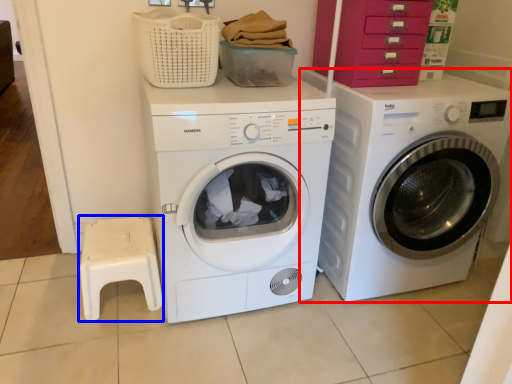
Question: Which object is closer to the camera taking this photo, washing machine (highlighted by a red box) or step stool (highlighted by a blue box)?

Choices:
 (A) washing machine
 (B) step stool

Answer: (A)